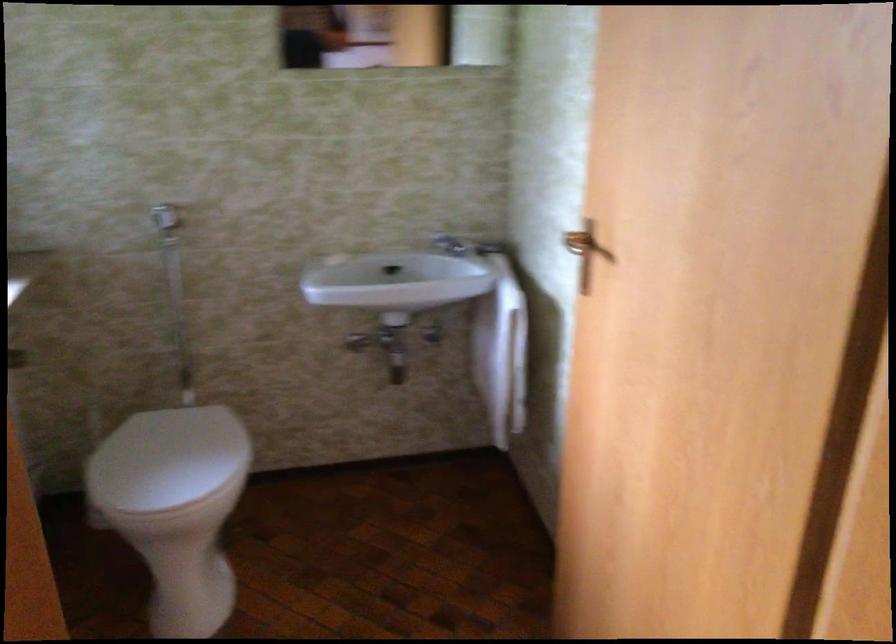
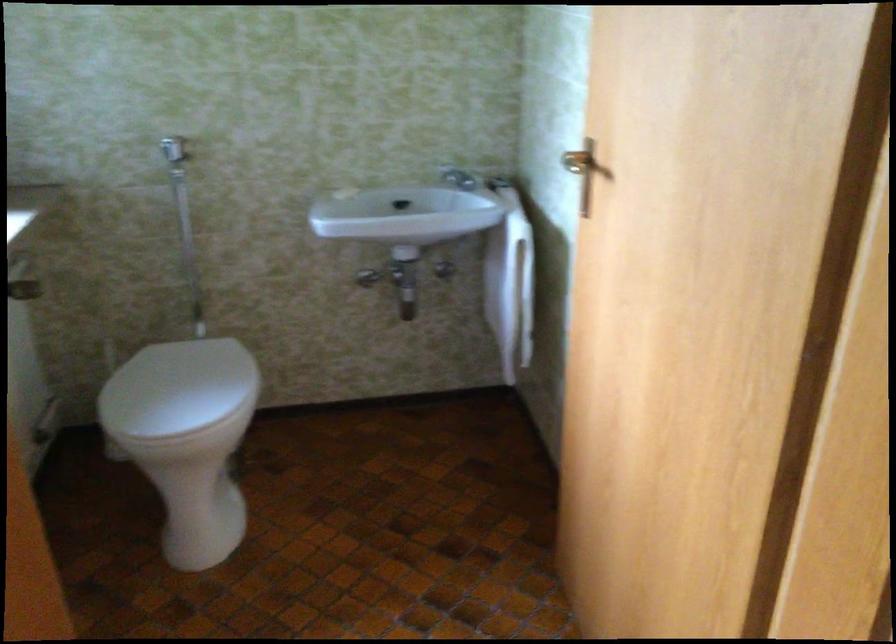
In the second image, find the point that corresponds to point (578, 241) in the first image.

(575, 162)